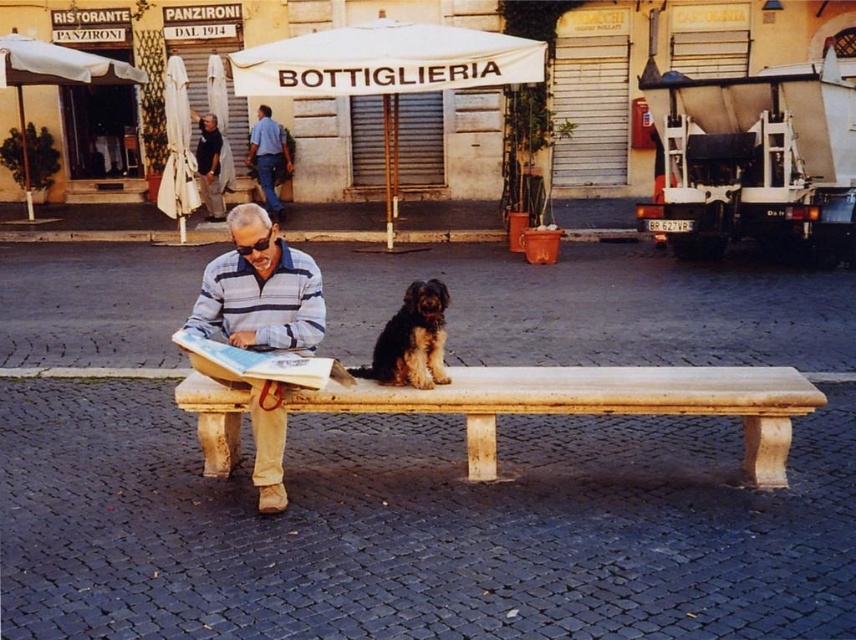
Is smooth stone bench at center positioned behind matte paper book at center?

Yes, it is.

Is smooth stone bench at center to the left of matte paper book at center from the viewer's perspective?

Incorrect, smooth stone bench at center is not on the left side of matte paper book at center.

Describe the element at coordinates (593, 403) in the screenshot. This screenshot has width=856, height=640. I see `smooth stone bench at center` at that location.

At what (x,y) coordinates should I click in order to perform the action: click on smooth stone bench at center. Please return your answer as a coordinate pair (x, y). Looking at the image, I should click on (593, 403).

Image resolution: width=856 pixels, height=640 pixels. In order to click on smooth stone bench at center in this screenshot , I will do pyautogui.click(x=593, y=403).

The width and height of the screenshot is (856, 640). Identify the location of matte paper book at center. (260, 362).

Can you confirm if matte paper book at center is shorter than dark blue shirt at upper left?

Yes.

Is point (311, 380) positioned in front of point (203, 132)?

Yes, it is in front of point (203, 132).

Identify the location of matte paper book at center. (260, 362).